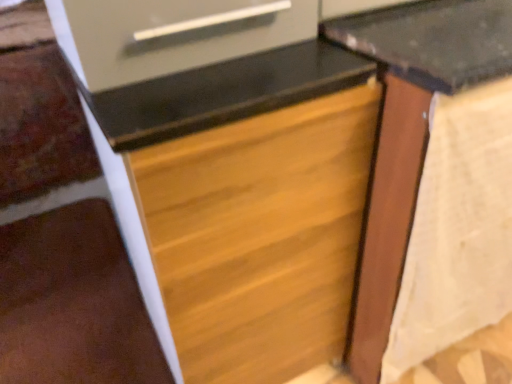
Question: Does wooden drawer at center have a lesser width compared to brown wood stairwell at lower left?

Choices:
 (A) yes
 (B) no

Answer: (A)

Question: Would you say wooden drawer at center is a long distance from brown wood stairwell at lower left?

Choices:
 (A) no
 (B) yes

Answer: (A)

Question: Is wooden drawer at center to the left of brown wood stairwell at lower left from the viewer's perspective?

Choices:
 (A) yes
 (B) no

Answer: (B)

Question: Is wooden drawer at center positioned with its back to brown wood stairwell at lower left?

Choices:
 (A) yes
 (B) no

Answer: (B)

Question: Would you say brown wood stairwell at lower left is part of wooden drawer at center's contents?

Choices:
 (A) yes
 (B) no

Answer: (B)

Question: From the image's perspective, would you say wooden drawer at center is positioned over brown wood stairwell at lower left?

Choices:
 (A) no
 (B) yes

Answer: (B)

Question: Is wooden table at center at the left side of brown wood stairwell at lower left?

Choices:
 (A) no
 (B) yes

Answer: (A)

Question: Is wooden table at center thinner than brown wood stairwell at lower left?

Choices:
 (A) no
 (B) yes

Answer: (B)

Question: Does wooden table at center have a smaller size compared to brown wood stairwell at lower left?

Choices:
 (A) no
 (B) yes

Answer: (A)

Question: Is wooden table at center wider than brown wood stairwell at lower left?

Choices:
 (A) yes
 (B) no

Answer: (B)

Question: Could you tell me if wooden table at center is facing brown wood stairwell at lower left?

Choices:
 (A) no
 (B) yes

Answer: (A)

Question: From the image's perspective, would you say wooden table at center is positioned over brown wood stairwell at lower left?

Choices:
 (A) yes
 (B) no

Answer: (A)

Question: Considering the relative sizes of wooden drawer at center and wooden table at center in the image provided, is wooden drawer at center smaller than wooden table at center?

Choices:
 (A) no
 (B) yes

Answer: (B)